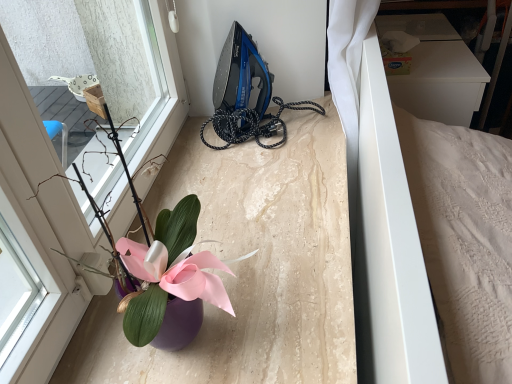
Find the location of a particular element. Image resolution: width=512 pixels, height=384 pixels. purple glossy vase at lower left is located at coordinates (165, 278).

Describe the element at coordinates (165, 278) in the screenshot. The height and width of the screenshot is (384, 512). I see `purple glossy vase at lower left` at that location.

The width and height of the screenshot is (512, 384). I want to click on purple glossy vase at lower left, so click(165, 278).